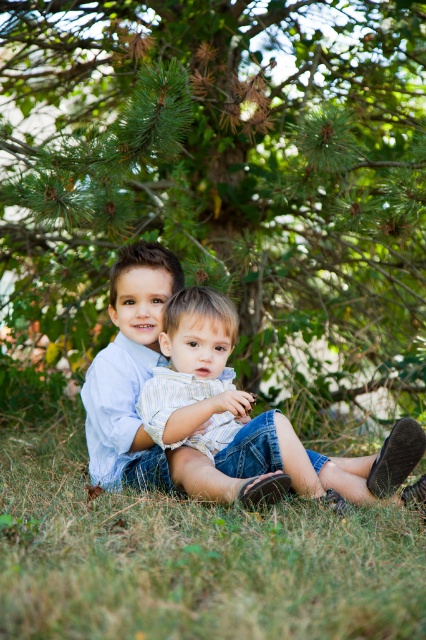
Describe the element at coordinates (192, 560) in the screenshot. I see `green grass at lower center` at that location.

What are the coordinates of `green grass at lower center` in the screenshot? It's located at pyautogui.click(x=192, y=560).

Locate an element on the screen. The image size is (426, 640). green grass at lower center is located at coordinates (192, 560).

At what (x,y) coordinates should I click in order to perform the action: click on green grass at lower center. Please return your answer as a coordinate pair (x, y). This screenshot has width=426, height=640. Looking at the image, I should click on (192, 560).

Is green textured pine tree at upper center positioned behind green grass at lower center?

Yes.

The image size is (426, 640). Describe the element at coordinates (221, 173) in the screenshot. I see `green textured pine tree at upper center` at that location.

Is point (40, 321) farther from camera compared to point (86, 545)?

That is True.

Image resolution: width=426 pixels, height=640 pixels. In order to click on green textured pine tree at upper center in this screenshot , I will do `click(221, 173)`.

The width and height of the screenshot is (426, 640). What do you see at coordinates (221, 173) in the screenshot?
I see `green textured pine tree at upper center` at bounding box center [221, 173].

Who is more distant from viewer, (158, 122) or (195, 340)?

Positioned behind is point (158, 122).

Is point (333, 52) less distant than point (216, 356)?

No.

Where is `green textured pine tree at upper center`? green textured pine tree at upper center is located at coordinates (221, 173).